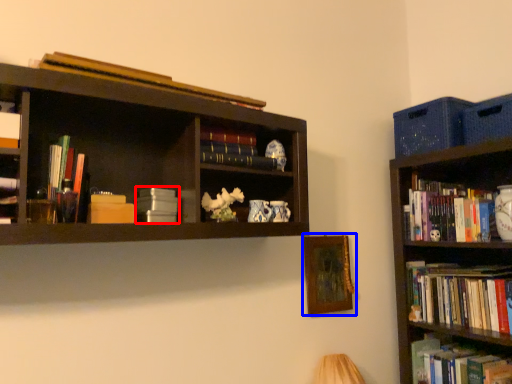
Question: Which object appears closest to the camera in this image, book (highlighted by a red box) or picture frame (highlighted by a blue box)?

Choices:
 (A) book
 (B) picture frame

Answer: (A)